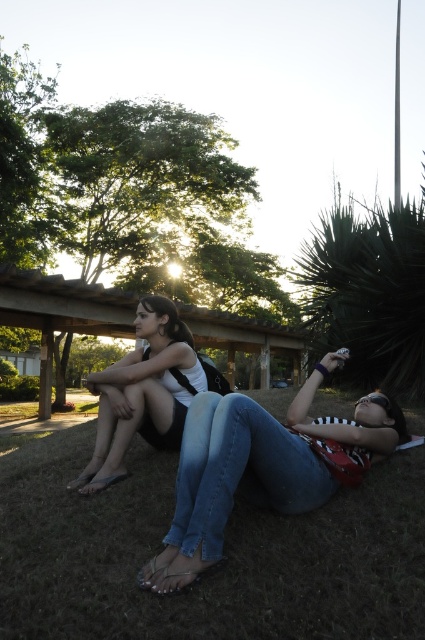
Question: Can you confirm if green grass at lower center is positioned to the right of matte white tank top at center?

Choices:
 (A) no
 (B) yes

Answer: (B)

Question: Among these points, which one is farthest from the camera?

Choices:
 (A) (306, 548)
 (B) (172, 353)

Answer: (B)

Question: Which of the following is the farthest from the observer?

Choices:
 (A) (181, 340)
 (B) (376, 577)
 (C) (204, 524)

Answer: (A)

Question: Considering the relative positions of green grass at lower center and denim jeans at lower center in the image provided, where is green grass at lower center located with respect to denim jeans at lower center?

Choices:
 (A) right
 (B) left

Answer: (B)

Question: Considering the real-world distances, which object is farthest from the denim jeans at lower center?

Choices:
 (A) green grass at lower center
 (B) matte white tank top at center

Answer: (B)

Question: Does green grass at lower center appear on the right side of matte white tank top at center?

Choices:
 (A) yes
 (B) no

Answer: (A)